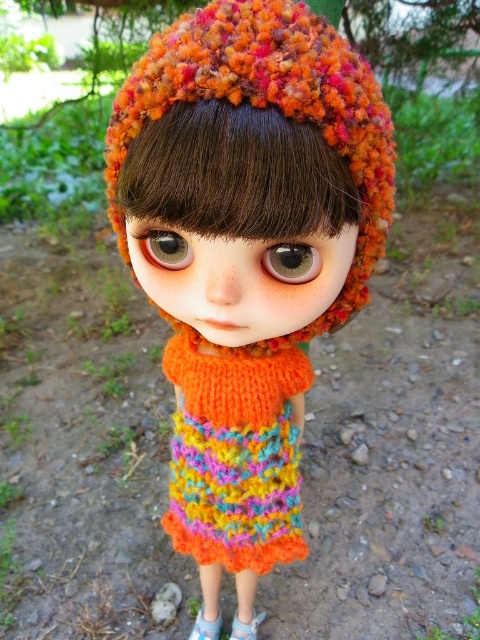
Question: In this image, where is knitted orange hat at center located relative to multicolored knitted dress at center?

Choices:
 (A) left
 (B) right

Answer: (B)

Question: Can you confirm if knitted orange hat at center is bigger than multicolored knitted dress at center?

Choices:
 (A) no
 (B) yes

Answer: (B)

Question: Can you confirm if knitted orange hat at center is positioned below multicolored knitted dress at center?

Choices:
 (A) yes
 (B) no

Answer: (B)

Question: Which of the following is the farthest from the observer?

Choices:
 (A) (227, 193)
 (B) (226, 554)

Answer: (B)

Question: Which point is farther from the camera taking this photo?

Choices:
 (A) (235, 493)
 (B) (204, 333)

Answer: (A)